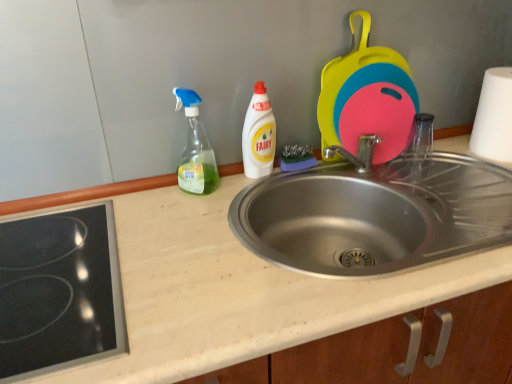
The width and height of the screenshot is (512, 384). I want to click on free spot to the left of white matte paper towel at right, so click(x=457, y=160).